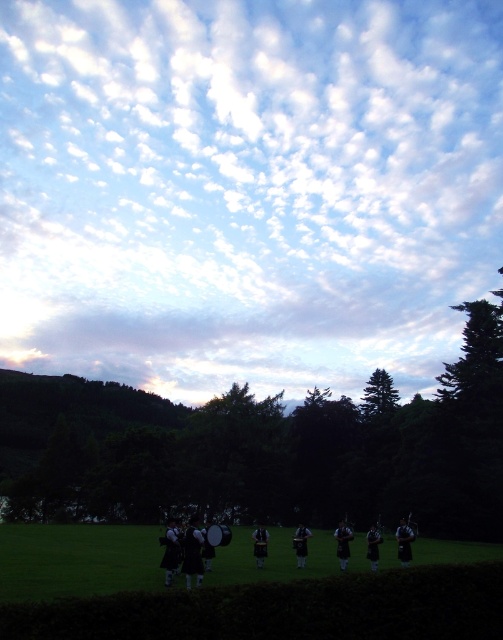
Question: Estimate the real-world distances between objects in this image. Which object is closer to the shiny black bagpipes at center?

Choices:
 (A) white fluffy clouds at upper center
 (B) dark blue fabric bagpipe at center

Answer: (B)

Question: Does dark blue fabric bagpipe at center come behind shiny black bagpipes at center?

Choices:
 (A) yes
 (B) no

Answer: (B)

Question: Which is nearer to the white fluffy clouds at upper center?

Choices:
 (A) dark blue fabric bagpipe at center
 (B) shiny black bagpipes at center

Answer: (B)

Question: Which object is closer to the camera taking this photo?

Choices:
 (A) white fluffy clouds at upper center
 (B) shiny black bagpipes at center
 (C) dark blue fabric bagpipe at center

Answer: (C)

Question: Does dark blue fabric bagpipe at center appear on the right side of shiny black bagpipes at center?

Choices:
 (A) no
 (B) yes

Answer: (B)

Question: In this image, where is white fluffy clouds at upper center located relative to shiny black bagpipes at center?

Choices:
 (A) below
 (B) above

Answer: (B)